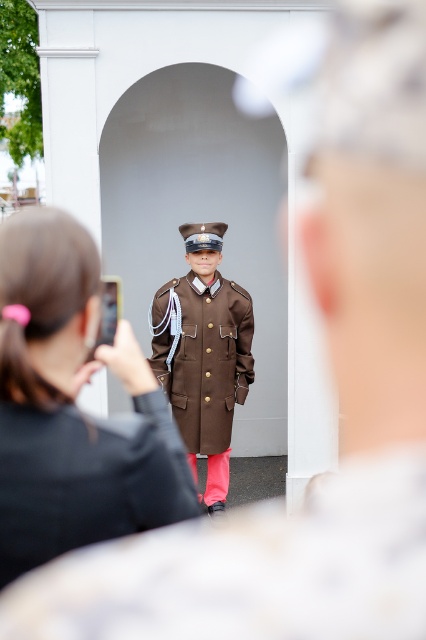
Question: Which of the following is the closest to the observer?

Choices:
 (A) matte black hair at center
 (B) brown matte uniform at center

Answer: (A)

Question: Is matte black hair at center closer to camera compared to brown matte uniform at center?

Choices:
 (A) yes
 (B) no

Answer: (A)

Question: Can you confirm if matte black hair at center is positioned to the right of brown matte uniform at center?

Choices:
 (A) yes
 (B) no

Answer: (B)

Question: Is matte black hair at center below brown matte uniform at center?

Choices:
 (A) yes
 (B) no

Answer: (B)